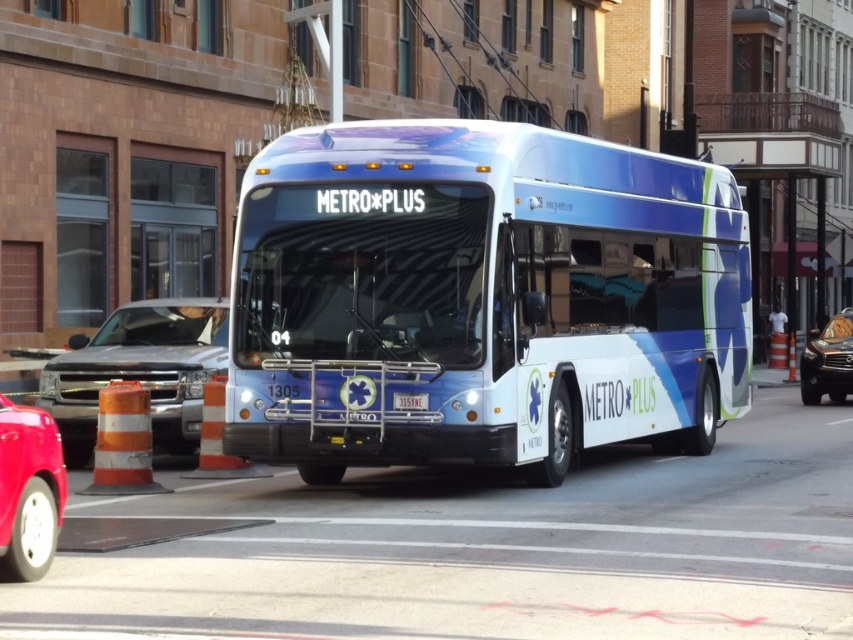
Question: Considering the real-world distances, which object is farthest from the blue metallic license plate at center?

Choices:
 (A) metallic silver truck at left
 (B) shiny red car at lower left
 (C) glass window at right
 (D) shiny metallic bus at center

Answer: (C)

Question: From the image, what is the correct spatial relationship of shiny metallic bus at center in relation to glass window at right?

Choices:
 (A) above
 (B) below

Answer: (B)

Question: Can you confirm if shiny silver suv at right is positioned above blue metallic license plate at center?

Choices:
 (A) yes
 (B) no

Answer: (B)

Question: Which is farther from the blue metallic license plate at center?

Choices:
 (A) shiny metallic bus at center
 (B) shiny red car at lower left
 (C) metallic silver truck at left
 (D) shiny silver suv at right

Answer: (D)

Question: Which point appears farthest from the camera in this image?

Choices:
 (A) (413, 403)
 (B) (1, 397)

Answer: (A)

Question: Can you confirm if glass window at right is positioned above blue metallic license plate at center?

Choices:
 (A) yes
 (B) no

Answer: (A)